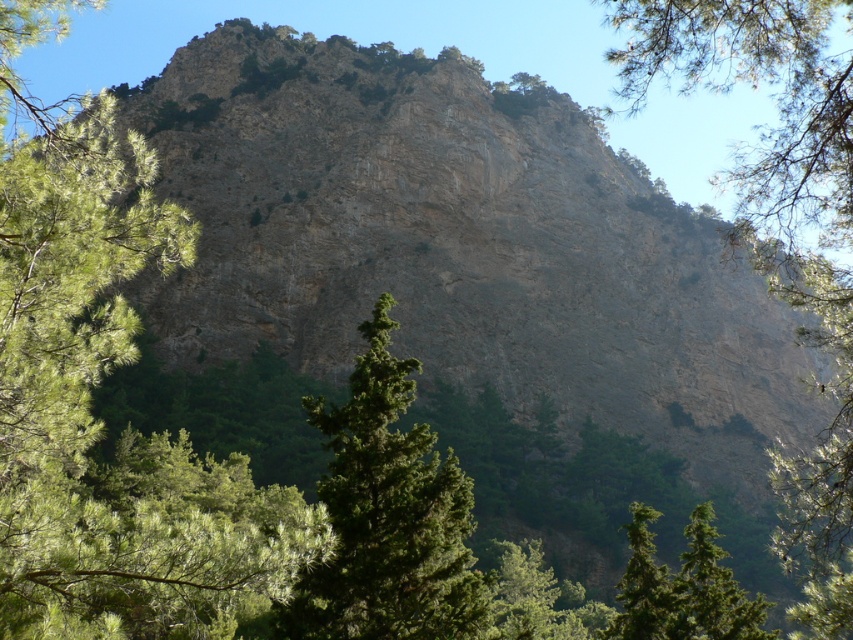
You are standing in the mountain area and want to take a photo of both the green leafy tree at left and the green textured tree at center. Which tree should you focus on first to ensure both are in clear view?

You should focus on the green leafy tree at left first because it is closer to the viewer than the green textured tree at center, so adjusting focus from near to far will help both be in clear view.

Looking at this image, you are a hiker standing at the base of the cliff and see the green leafy tree at left and the green leafy tree at upper right. Which tree is closer to you?

The green leafy tree at left is closer to you because it is positioned in front of the green leafy tree at upper right.